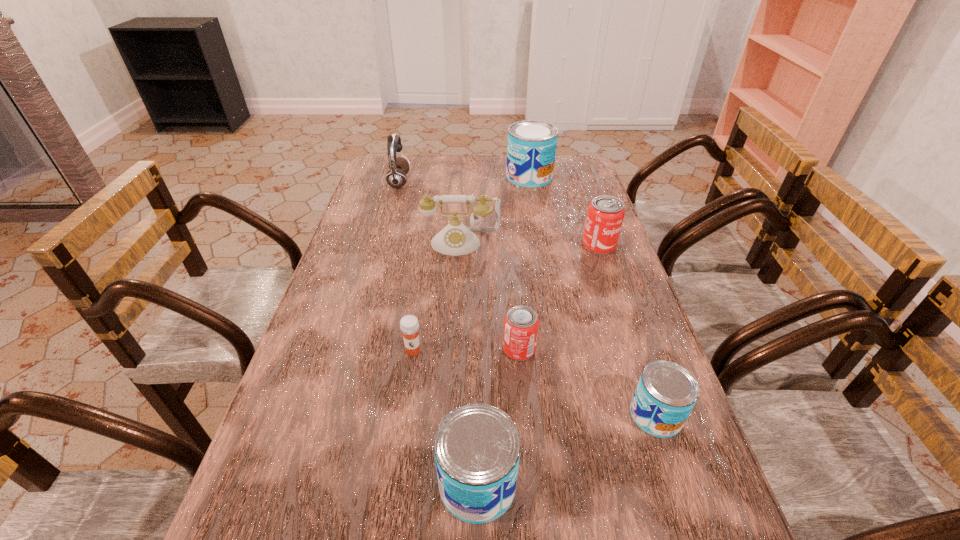
At what (x,y) coordinates should I click in order to perform the action: click on the third nearest can. Please return your answer as a coordinate pair (x, y). Looking at the image, I should click on (521, 323).

I want to click on the smallest blue can, so click(666, 393).

At what (x,y) coordinates should I click in order to perform the action: click on the fourth farthest can. Please return your answer as a coordinate pair (x, y). Looking at the image, I should click on (666, 393).

Locate an element on the screen. medicine is located at coordinates (409, 325).

The height and width of the screenshot is (540, 960). In order to click on vacant space located 0.090m on the ear pads of the earphone in this screenshot , I will do `click(434, 182)`.

Locate an element on the screen. The width and height of the screenshot is (960, 540). free region located on the left of the farthest blue can is located at coordinates (435, 177).

The image size is (960, 540). I want to click on blank area located on the dial of the white telephone, so click(x=453, y=369).

Where is `vacant region located 0.400m on the back of the fourth nearest can`? The height and width of the screenshot is (540, 960). vacant region located 0.400m on the back of the fourth nearest can is located at coordinates (574, 173).

I want to click on free location located on the back of the nearest can, so click(478, 322).

Find the location of `vacant area situated 0.240m on the back of the smaller red can`. vacant area situated 0.240m on the back of the smaller red can is located at coordinates (513, 271).